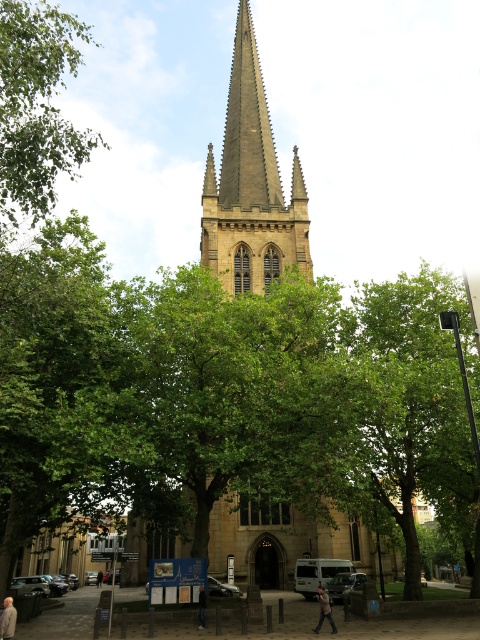
Question: Is brown stone spire at center thinner than gray fabric jacket at lower left?

Choices:
 (A) yes
 (B) no

Answer: (B)

Question: Which point is closer to the camera taking this photo?

Choices:
 (A) (252, 49)
 (B) (252, 106)
 (C) (204, 608)

Answer: (C)

Question: Which of the following is the closest to the observer?

Choices:
 (A) green leafy tree at upper left
 (B) dark gray jacket at lower center
 (C) gray fabric jacket at lower left

Answer: (B)

Question: Which point is farther to the camera?

Choices:
 (A) dark gray fabric jacket at lower left
 (B) dark gray jeans at lower center

Answer: (A)

Question: Can you confirm if dark gray jeans at lower center is positioned below dark gray fabric jacket at center?

Choices:
 (A) yes
 (B) no

Answer: (B)

Question: Does gray fabric jacket at lower left appear over dark gray jacket at lower center?

Choices:
 (A) no
 (B) yes

Answer: (A)